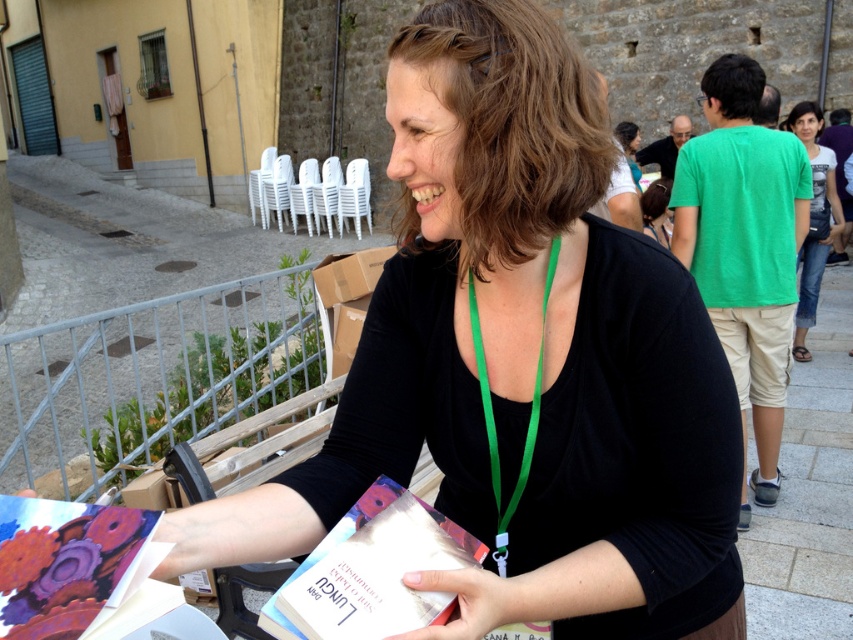
What do you see at coordinates (521, 362) in the screenshot? The width and height of the screenshot is (853, 640). I see `black matte shirt at center` at bounding box center [521, 362].

Can you confirm if black matte shirt at center is positioned to the right of hardcover book at center?

Indeed, black matte shirt at center is positioned on the right side of hardcover book at center.

Does point (544, 99) come behind point (363, 602)?

Yes, point (544, 99) is farther from viewer.

I want to click on black matte shirt at center, so click(x=521, y=362).

In the scene shown: Who is lower down, hardcover book at center or metallic gear design book at lower left?

hardcover book at center

Measure the distance between hardcover book at center and camera.

hardcover book at center is 25.15 inches away from camera.

At what (x,y) coordinates should I click in order to perform the action: click on hardcover book at center. Please return your answer as a coordinate pair (x, y). Image resolution: width=853 pixels, height=640 pixels. Looking at the image, I should click on (370, 572).

Does metallic gear design book at lower left appear on the left side of denim jeans at right?

Correct, you'll find metallic gear design book at lower left to the left of denim jeans at right.

Is point (113, 592) positioned after point (811, 276)?

No, (113, 592) is in front of (811, 276).

The image size is (853, 640). What do you see at coordinates (64, 563) in the screenshot? I see `metallic gear design book at lower left` at bounding box center [64, 563].

Where is `metallic gear design book at lower left`? The image size is (853, 640). metallic gear design book at lower left is located at coordinates (64, 563).